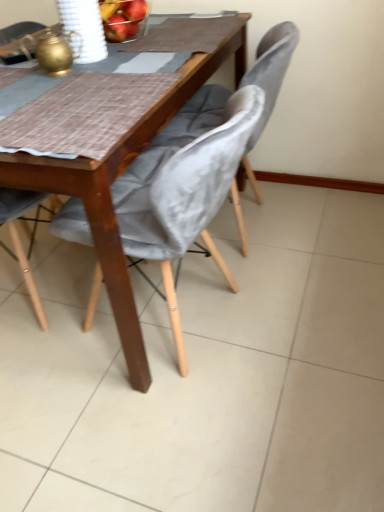
Question: From a real-world perspective, relative to velvet grey chair at lower left, the 3th chair positioned from the right, is velvet grey chair at center, the 1th chair in the right-to-left sequence, vertically above or below?

Choices:
 (A) above
 (B) below

Answer: (B)

Question: Is velvet grey chair at center, the third chair from the left, inside the boundaries of velvet grey chair at lower left, which is the 1th chair from left to right, or outside?

Choices:
 (A) inside
 (B) outside

Answer: (B)

Question: Which object is positioned farthest from the velvet grey chair at lower left, which is the 1th chair from left to right?

Choices:
 (A) velvet grey chair at center, the second chair positioned from the left
 (B) velvet grey chair at center, the third chair from the left

Answer: (B)

Question: Based on their relative distances, which object is farther from the velvet grey chair at center, the second chair positioned from the left?

Choices:
 (A) velvet grey chair at lower left, the 3th chair positioned from the right
 (B) velvet grey chair at center, the third chair from the left

Answer: (A)